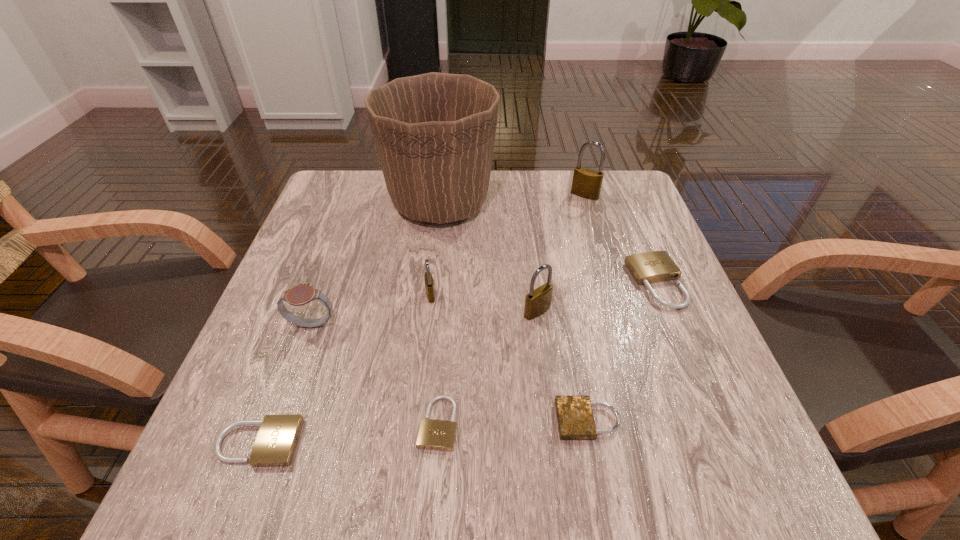
Find the location of `the leftmost beige padlock`. the leftmost beige padlock is located at coordinates (276, 441).

Where is `the second smallest beige padlock`? The height and width of the screenshot is (540, 960). the second smallest beige padlock is located at coordinates (276, 441).

The image size is (960, 540). What are the coordinates of `the shortest padlock` in the screenshot? It's located at 439,435.

This screenshot has width=960, height=540. I want to click on the shortest object, so click(439, 435).

Find the location of a particular element. Image resolution: width=960 pixels, height=540 pixels. vacant space located on the front of the tallest object is located at coordinates (434, 261).

Locate an element on the screen. This screenshot has width=960, height=540. free space located on the front of the biggest brass padlock is located at coordinates (611, 280).

Image resolution: width=960 pixels, height=540 pixels. What are the coordinates of `free location located on the back of the seventh shortest object` in the screenshot? It's located at (524, 208).

Where is `free space located 0.330m on the right of the smallest brass padlock`? This screenshot has width=960, height=540. free space located 0.330m on the right of the smallest brass padlock is located at coordinates (600, 295).

The image size is (960, 540). In order to click on free space located on the back of the gray watch in this screenshot , I will do point(356,201).

Find the location of a particular element. The image size is (960, 540). free space located on the left of the fourth shortest object is located at coordinates pyautogui.click(x=539, y=282).